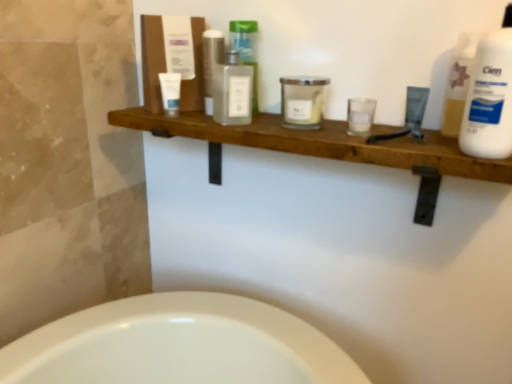
Where is `vacant area situated to the left side of white plastic bottle at upper right`? vacant area situated to the left side of white plastic bottle at upper right is located at coordinates (406, 161).